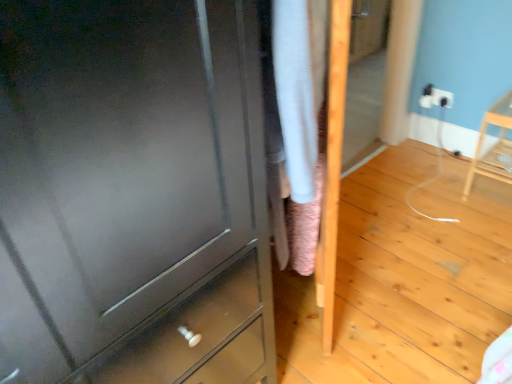
Locate an element on the screen. free space to the left of light wood chair at right is located at coordinates (441, 194).